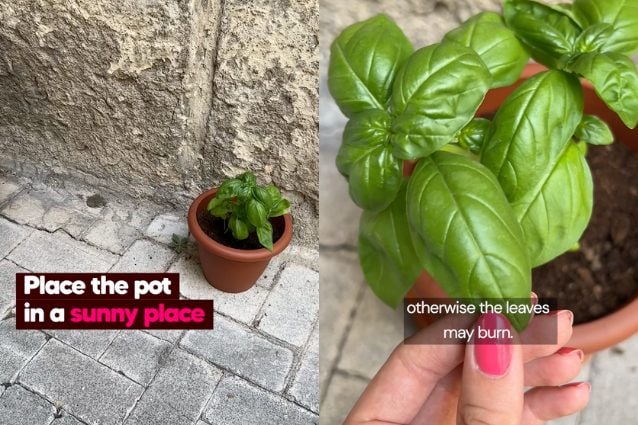
Locate an element on the screen. bottom of planter on left is located at coordinates (232, 291).